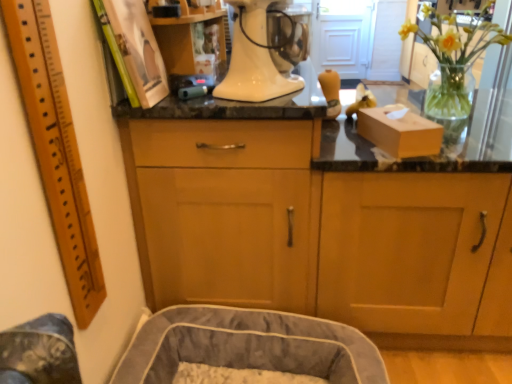
What do you see at coordinates (249, 345) in the screenshot? The image size is (512, 384). I see `soft gray fabric dog bed at lower left` at bounding box center [249, 345].

What do you see at coordinates (56, 150) in the screenshot?
I see `wooden ruler at left` at bounding box center [56, 150].

The height and width of the screenshot is (384, 512). What do you see at coordinates (407, 249) in the screenshot?
I see `wooden cabinet at center, acting as the first cabinetry starting from the right` at bounding box center [407, 249].

The image size is (512, 384). What do you see at coordinates (228, 211) in the screenshot? I see `wooden cabinet at center, placed as the 1th cabinetry when sorted from left to right` at bounding box center [228, 211].

This screenshot has height=384, width=512. Describe the element at coordinates (254, 57) in the screenshot. I see `white glossy stand mixer at center` at that location.

Locate an element on the screen. soft gray fabric dog bed at lower left is located at coordinates (249, 345).

Between soft gray fabric dog bed at lower left and matte cardboard box at right, which one has larger size?

Bigger between the two is soft gray fabric dog bed at lower left.

Is point (300, 318) closer or farther from the camera than point (401, 109)?

Point (300, 318) appears to be farther away from the viewer than point (401, 109).

Which is correct: soft gray fabric dog bed at lower left is inside matte cardboard box at right, or outside of it?

soft gray fabric dog bed at lower left is outside matte cardboard box at right.

From a real-world perspective, who is located lower, soft gray fabric dog bed at lower left or matte cardboard box at right?

soft gray fabric dog bed at lower left is physically lower.

Visually, is soft gray fabric dog bed at lower left positioned to the left or to the right of wooden cabinet at center, acting as the 2th cabinetry starting from the right?

From the image, it's evident that soft gray fabric dog bed at lower left is to the right of wooden cabinet at center, acting as the 2th cabinetry starting from the right.

From a real-world perspective, is soft gray fabric dog bed at lower left above or below wooden cabinet at center, acting as the 2th cabinetry starting from the right?

soft gray fabric dog bed at lower left is below wooden cabinet at center, acting as the 2th cabinetry starting from the right.

Considering their positions, is soft gray fabric dog bed at lower left located in front of or behind wooden cabinet at center, acting as the 2th cabinetry starting from the right?

Visually, soft gray fabric dog bed at lower left is located in front of wooden cabinet at center, acting as the 2th cabinetry starting from the right.

Is soft gray fabric dog bed at lower left turned away from wooden cabinet at center, acting as the 2th cabinetry starting from the right?

soft gray fabric dog bed at lower left does not have its back to wooden cabinet at center, acting as the 2th cabinetry starting from the right.

The width and height of the screenshot is (512, 384). What are the coordinates of `home appliance that appears in front of the matte cardboard box at right` in the screenshot? It's located at (254, 57).

Which object is further away from the camera taking this photo, matte cardboard box at right or white glossy stand mixer at center?

matte cardboard box at right is further from the camera.

Consider the image. Is matte cardboard box at right not close to white glossy stand mixer at center?

No, matte cardboard box at right is in close proximity to white glossy stand mixer at center.

Which object is positioned more to the left, matte cardboard box at right or white glossy stand mixer at center?

white glossy stand mixer at center.

Can you confirm if wooden ruler at left is taller than wooden cabinet at center, acting as the 2th cabinetry starting from the right?

No, wooden ruler at left is not taller than wooden cabinet at center, acting as the 2th cabinetry starting from the right.

The width and height of the screenshot is (512, 384). I want to click on cabinetry lying above the wooden ruler at left (from the image's perspective), so click(x=228, y=211).

Are wooden ruler at left and wooden cabinet at center, acting as the 2th cabinetry starting from the right, located far from each other?

wooden ruler at left is near wooden cabinet at center, acting as the 2th cabinetry starting from the right, not far away.

Is point (255, 25) in front of point (205, 305)?

Yes.

Can soft gray fabric dog bed at lower left be found inside white glossy stand mixer at center?

No.

The image size is (512, 384). Find the location of `home appliance on the right of soft gray fabric dog bed at lower left`. home appliance on the right of soft gray fabric dog bed at lower left is located at coordinates (254, 57).

How distant is white glossy stand mixer at center from soft gray fabric dog bed at lower left?

white glossy stand mixer at center and soft gray fabric dog bed at lower left are 29.50 inches apart from each other.

The height and width of the screenshot is (384, 512). I want to click on home appliance located above the wooden cabinet at center, acting as the 2th cabinetry starting from the left (from a real-world perspective), so click(254, 57).

From the image's perspective, which is below, wooden cabinet at center, acting as the 2th cabinetry starting from the left, or white glossy stand mixer at center?

wooden cabinet at center, acting as the 2th cabinetry starting from the left, is shown below in the image.

Is point (387, 287) in front of point (253, 69)?

No, (387, 287) is further to viewer.

Is wooden cabinet at center, acting as the 2th cabinetry starting from the left, turned away from white glossy stand mixer at center?

No.

Does white glossy stand mixer at center have a lesser height compared to wooden cabinet at center, acting as the 2th cabinetry starting from the right?

Yes, white glossy stand mixer at center is shorter than wooden cabinet at center, acting as the 2th cabinetry starting from the right.

Do you think white glossy stand mixer at center is within wooden cabinet at center, placed as the 1th cabinetry when sorted from left to right, or outside of it?

white glossy stand mixer at center is not enclosed by wooden cabinet at center, placed as the 1th cabinetry when sorted from left to right.

Can you tell me how much white glossy stand mixer at center and wooden cabinet at center, placed as the 1th cabinetry when sorted from left to right, differ in facing direction?

60.9 degrees.

Is point (261, 44) positioned before point (298, 286)?

Yes, point (261, 44) is in front of point (298, 286).

Where is `dog bed in front of the matte cardboard box at right`? dog bed in front of the matte cardboard box at right is located at coordinates (249, 345).

This screenshot has width=512, height=384. Find the location of `dog bed directly beneath the wooden cabinet at center, placed as the 1th cabinetry when sorted from left to right (from a real-world perspective)`. dog bed directly beneath the wooden cabinet at center, placed as the 1th cabinetry when sorted from left to right (from a real-world perspective) is located at coordinates (249, 345).

Estimate the real-world distances between objects in this image. Which object is closer to soft gray fabric dog bed at lower left, wooden cabinet at center, acting as the first cabinetry starting from the right, or wooden cabinet at center, placed as the 1th cabinetry when sorted from left to right?

Among the two, wooden cabinet at center, placed as the 1th cabinetry when sorted from left to right, is located nearer to soft gray fabric dog bed at lower left.

From the image, which object appears to be nearer to matte cardboard box at right, wooden ruler at left or white glossy stand mixer at center?

Based on the image, white glossy stand mixer at center appears to be nearer to matte cardboard box at right.

Which object lies further to the anchor point white glossy stand mixer at center, soft gray fabric dog bed at lower left or matte cardboard box at right?

soft gray fabric dog bed at lower left is further to white glossy stand mixer at center.

Based on the photo, which object lies further to the anchor point wooden ruler at left, wooden cabinet at center, acting as the 2th cabinetry starting from the right, or white glossy stand mixer at center?

white glossy stand mixer at center is further to wooden ruler at left.

Based on their spatial positions, is soft gray fabric dog bed at lower left or wooden cabinet at center, acting as the 2th cabinetry starting from the right, closer to wooden ruler at left?

Among the two, wooden cabinet at center, acting as the 2th cabinetry starting from the right, is located nearer to wooden ruler at left.

From the image, which object appears to be nearer to wooden ruler at left, wooden cabinet at center, acting as the first cabinetry starting from the right, or white glossy stand mixer at center?

white glossy stand mixer at center is closer to wooden ruler at left.

Looking at the image, which one is located further to wooden ruler at left, wooden cabinet at center, acting as the first cabinetry starting from the right, or soft gray fabric dog bed at lower left?

Among the two, wooden cabinet at center, acting as the first cabinetry starting from the right, is located further to wooden ruler at left.

Looking at the image, which one is located further to wooden ruler at left, wooden cabinet at center, placed as the 1th cabinetry when sorted from left to right, or matte cardboard box at right?

Based on the image, matte cardboard box at right appears to be further to wooden ruler at left.

Identify the location of cabinetry between white glossy stand mixer at center and wooden ruler at left in the up-down direction. Image resolution: width=512 pixels, height=384 pixels. (228, 211).

Where is `cardboard box situated between white glossy stand mixer at center and wooden cabinet at center, acting as the first cabinetry starting from the right, from left to right`? The width and height of the screenshot is (512, 384). cardboard box situated between white glossy stand mixer at center and wooden cabinet at center, acting as the first cabinetry starting from the right, from left to right is located at coordinates (399, 132).

Where is `cardboard box between wooden cabinet at center, acting as the 2th cabinetry starting from the right, and wooden cabinet at center, acting as the 2th cabinetry starting from the left`? This screenshot has width=512, height=384. cardboard box between wooden cabinet at center, acting as the 2th cabinetry starting from the right, and wooden cabinet at center, acting as the 2th cabinetry starting from the left is located at coordinates (399, 132).

This screenshot has width=512, height=384. Identify the location of cardboard box located between wooden ruler at left and wooden cabinet at center, acting as the first cabinetry starting from the right, in the left-right direction. (399, 132).